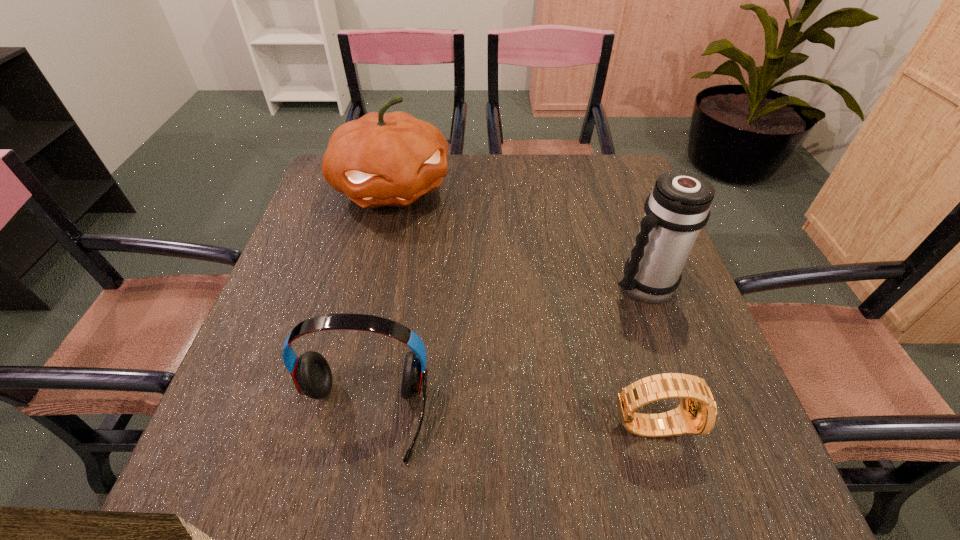
At what (x,y) coordinates should I click in order to perform the action: click on vacant space on the desktop that is between the third tallest object and the shortest object and is positioned on the side with the handle of the thermos bottle. Please return your answer as a coordinate pair (x, y). The width and height of the screenshot is (960, 540). Looking at the image, I should click on (484, 419).

The image size is (960, 540). In order to click on free space on the desktop that is between the headset and the shortest object and is positioned on the front face of the pumpkin in this screenshot , I will do pyautogui.click(x=531, y=420).